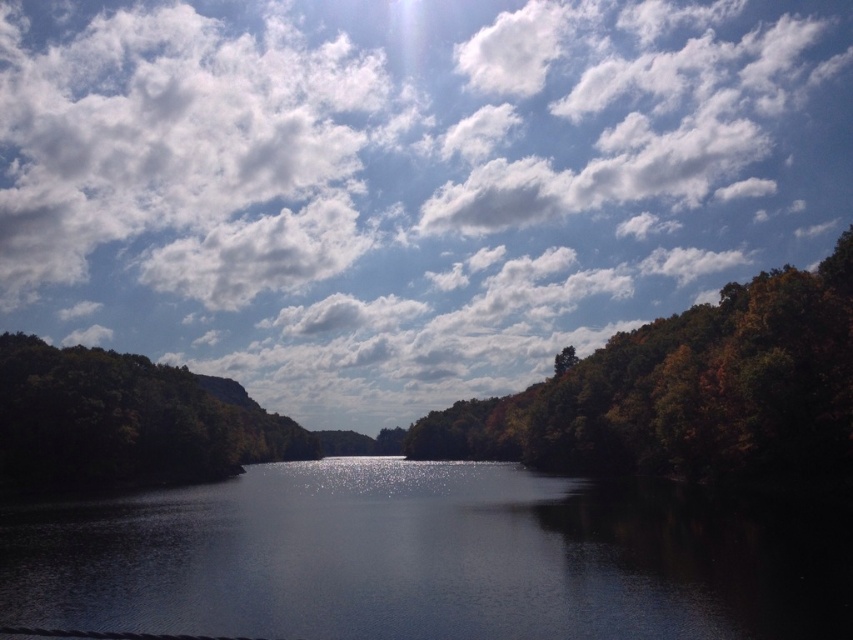
Between white fluffy cloud at upper center and autumn leaves at right, which one has less height?

With less height is autumn leaves at right.

Who is higher up, white fluffy cloud at upper center or autumn leaves at right?

white fluffy cloud at upper center is above.

Find the location of a particular element. This screenshot has height=640, width=853. white fluffy cloud at upper center is located at coordinates (405, 180).

Between point (97, 104) and point (230, 413), which one is positioned in front?

Point (230, 413) is more forward.

Consider the image. Between white fluffy cloud at upper center and green matte tree at left, which one has more height?

white fluffy cloud at upper center

Is point (550, 250) positioned in front of point (292, 449)?

No, (550, 250) is further to viewer.

Locate an element on the screen. white fluffy cloud at upper center is located at coordinates (405, 180).

Is point (548, 499) positioned behind point (525, 438)?

No, it is in front of (525, 438).

Can you confirm if dark reflective water at center is positioned below autumn leaves at right?

No.

Between point (445, 611) and point (825, 344), which one is positioned in front?

Positioned in front is point (445, 611).

Locate an element on the screen. dark reflective water at center is located at coordinates (427, 557).